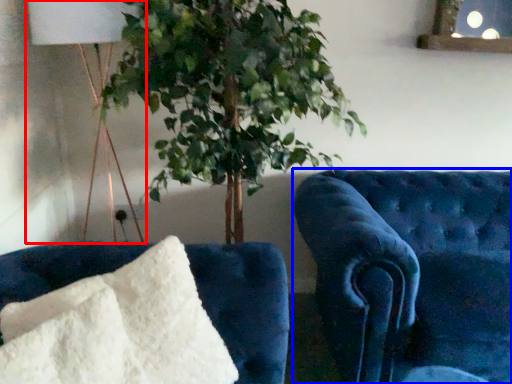
Question: Which of the following is the closest to the observer, table lamp (highlighted by a red box) or furniture (highlighted by a blue box)?

Choices:
 (A) table lamp
 (B) furniture

Answer: (B)